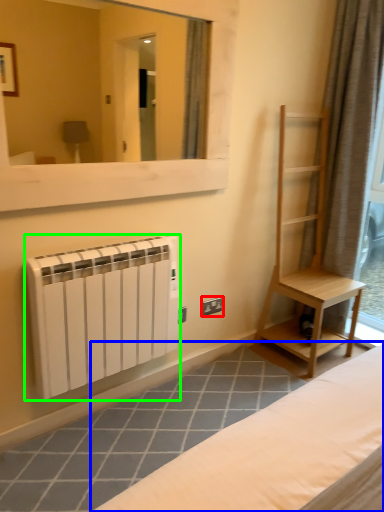
Question: Based on their relative distances, which object is farther from electric outlet (highlighted by a red box)? Choose from furniture (highlighted by a blue box) and radiator (highlighted by a green box).

Choices:
 (A) furniture
 (B) radiator

Answer: (A)